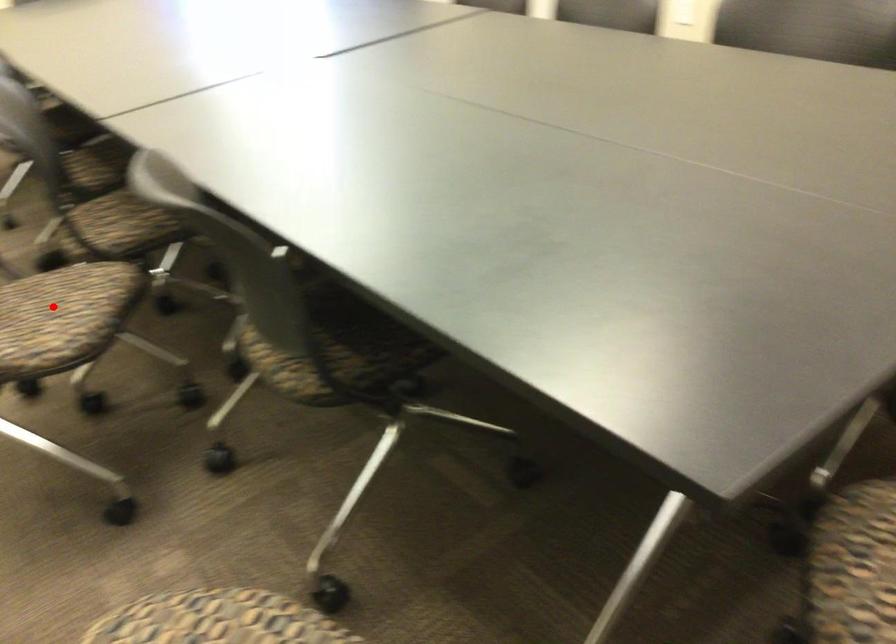
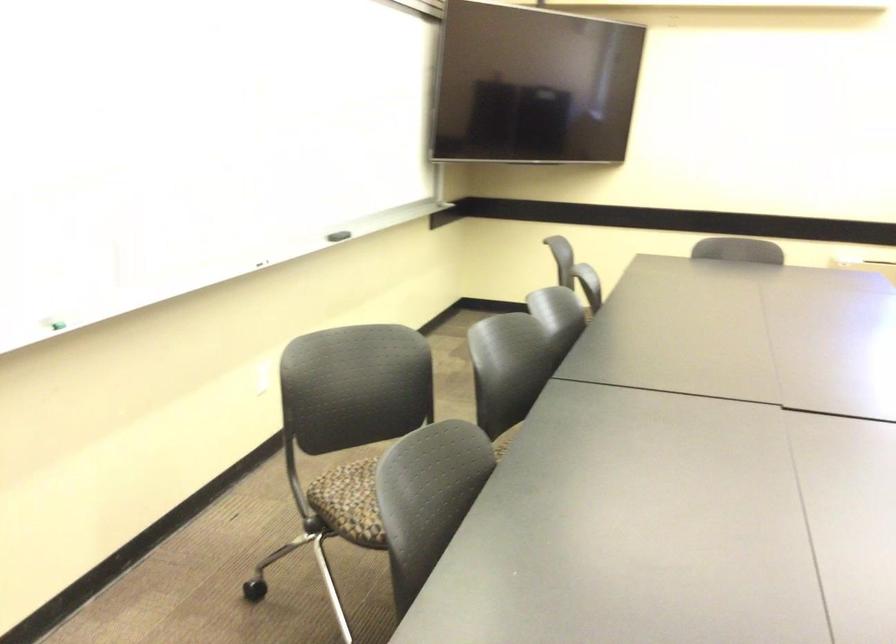
Question: I am providing you with two images of the same scene from different viewpoints. A red point is marked on the first image. Is the red point's position out of view in image 2?

Choices:
 (A) Yes
 (B) No

Answer: (A)